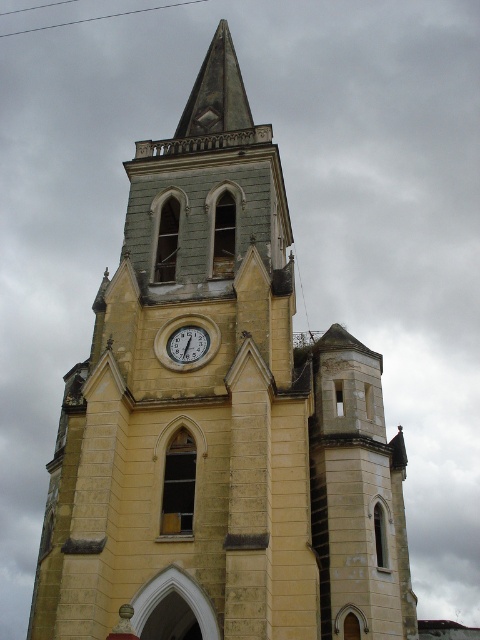
You are standing in front of the historic church tower and want to take a photo of the white glossy clock at center. Based on its position, where should you aim your camera to capture it?

The white glossy clock at center is located at point (187, 340), so you should aim your camera at those coordinates to capture it.

Looking at this image, you are standing at the base of the historic church tower. The camera is positioned at a point [173,332] relative to the tower. If you want to take a photo of the clock face located near the midpoint of the tower, will you need to look up or down from the camera position to frame the clock properly?

The point [173,332] is 53.77 meters away from the camera. Since the clock face is located near the midpoint of the tower, which is taller than the camera position, you would need to look up to frame the clock properly.